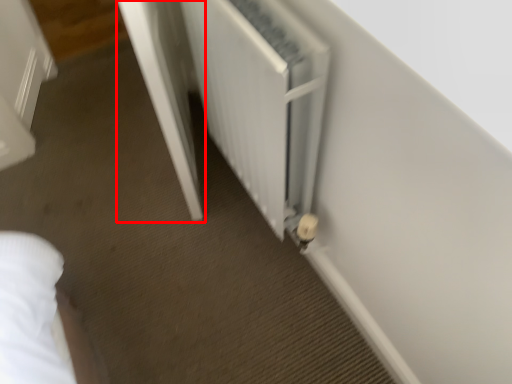
Question: From the image's perspective, where is screen door (annotated by the red box) located relative to radiator?

Choices:
 (A) above
 (B) below

Answer: (A)